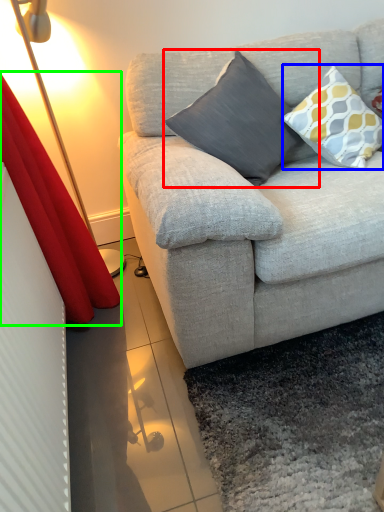
Question: Based on their relative distances, which object is nearer to pillow (highlighted by a red box)? Choose from pillow (highlighted by a blue box) and curtain (highlighted by a green box).

Choices:
 (A) pillow
 (B) curtain

Answer: (A)